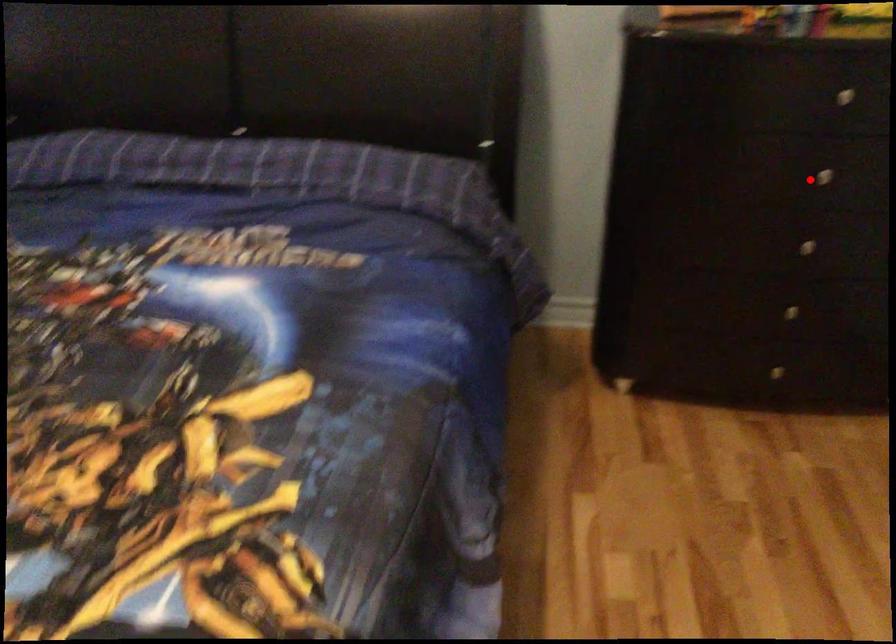
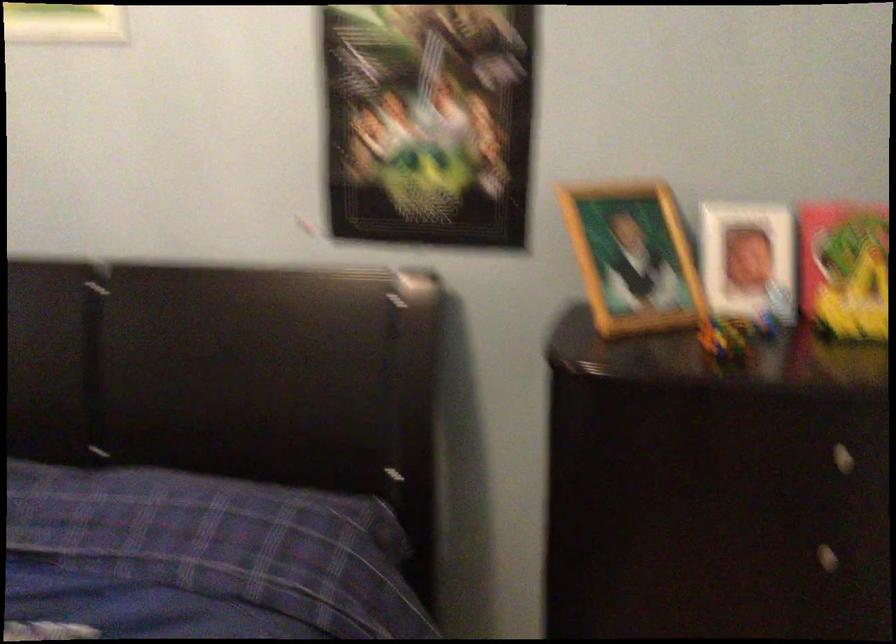
Question: I am providing you with two images of the same scene from different viewpoints. A red point is marked on the first image. Can you still see the location of the red point in image 2?

Choices:
 (A) Yes
 (B) No

Answer: (A)